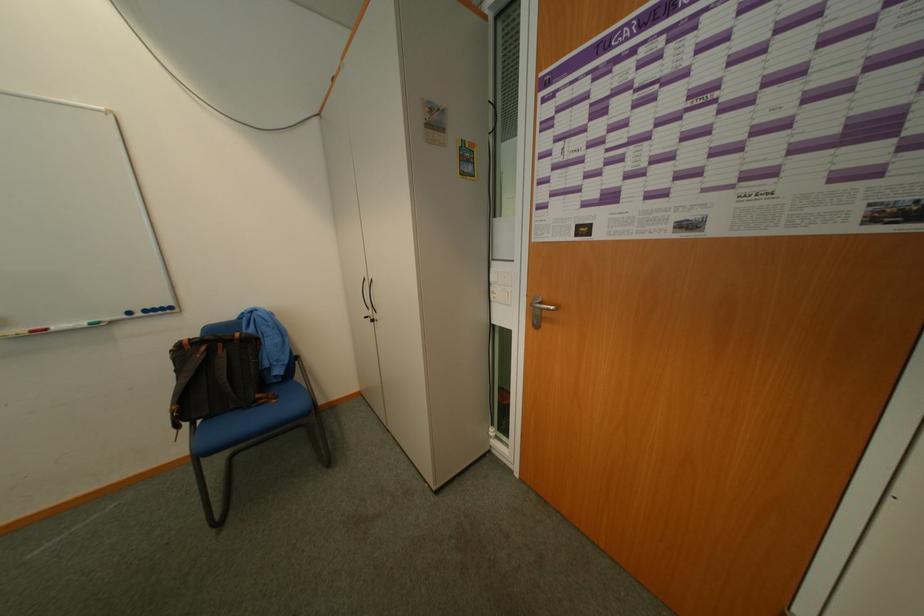
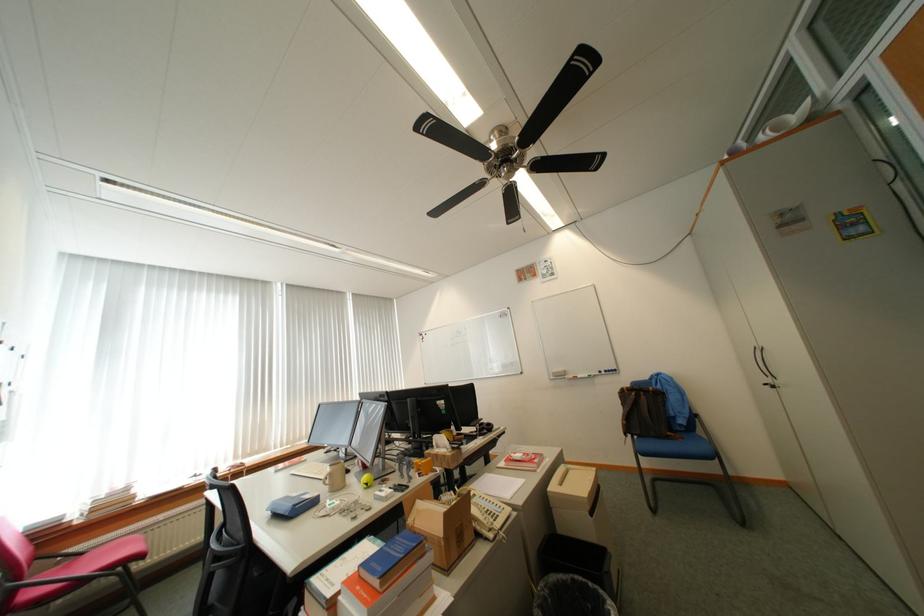
Where in the second image is the point corresponding to pixel 307 378 from the first image?

(709, 432)